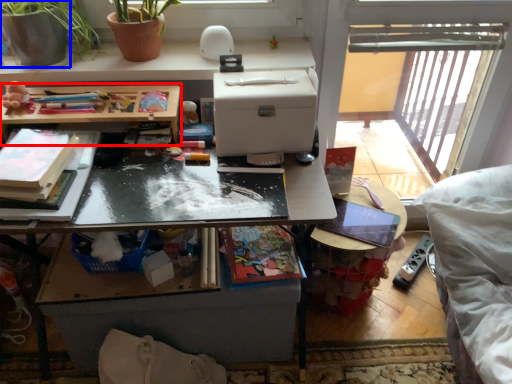
Question: Which of the following is the farthest to the observer, table (highlighted by a red box) or flowerpot (highlighted by a blue box)?

Choices:
 (A) table
 (B) flowerpot

Answer: (B)